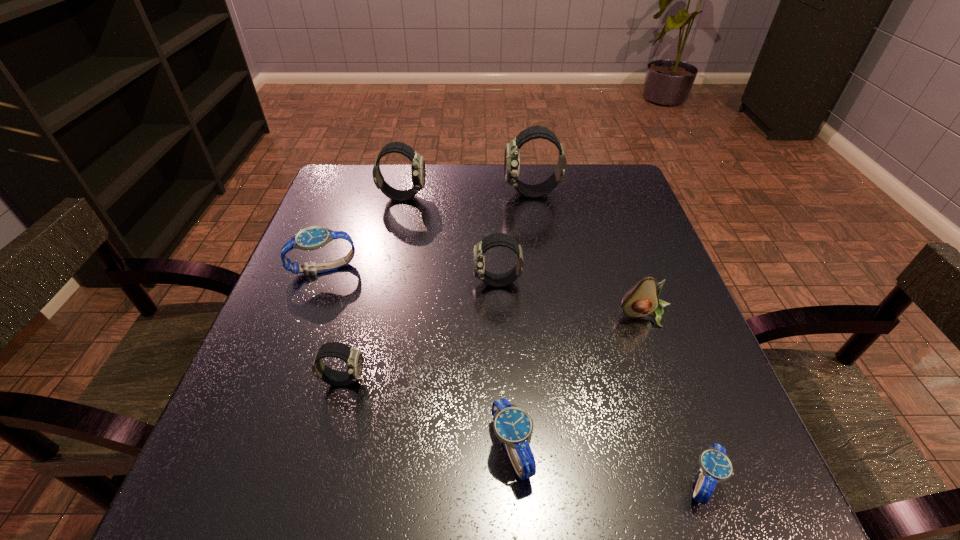
Where is `object present at the near right corner`? object present at the near right corner is located at coordinates (715, 466).

Image resolution: width=960 pixels, height=540 pixels. I want to click on free space at the far edge of the desktop, so click(546, 177).

Locate an element on the screen. The image size is (960, 540). vacant region at the near edge of the desktop is located at coordinates (440, 505).

Locate an element on the screen. vacant space at the left edge of the desktop is located at coordinates (x=308, y=375).

In the image, there is a desktop. Where is `blank space at the right edge`? blank space at the right edge is located at coordinates (643, 379).

Find the location of `vacant region at the far left corner of the desktop`. vacant region at the far left corner of the desktop is located at coordinates (392, 174).

Image resolution: width=960 pixels, height=540 pixels. In order to click on vacant space at the far right corner in this screenshot , I will do click(x=598, y=165).

Locate an element on the screen. free space that is in between the second nearest dark watch and the smallest dark watch is located at coordinates (420, 331).

At what (x,y) coordinates should I click in order to perform the action: click on unoccupied area between the second blue watch from right to left and the third nearest object. Please return your answer as a coordinate pair (x, y). This screenshot has height=540, width=960. Looking at the image, I should click on (427, 414).

The height and width of the screenshot is (540, 960). I want to click on vacant area that lies between the fifth farthest watch and the third biggest dark watch, so click(420, 331).